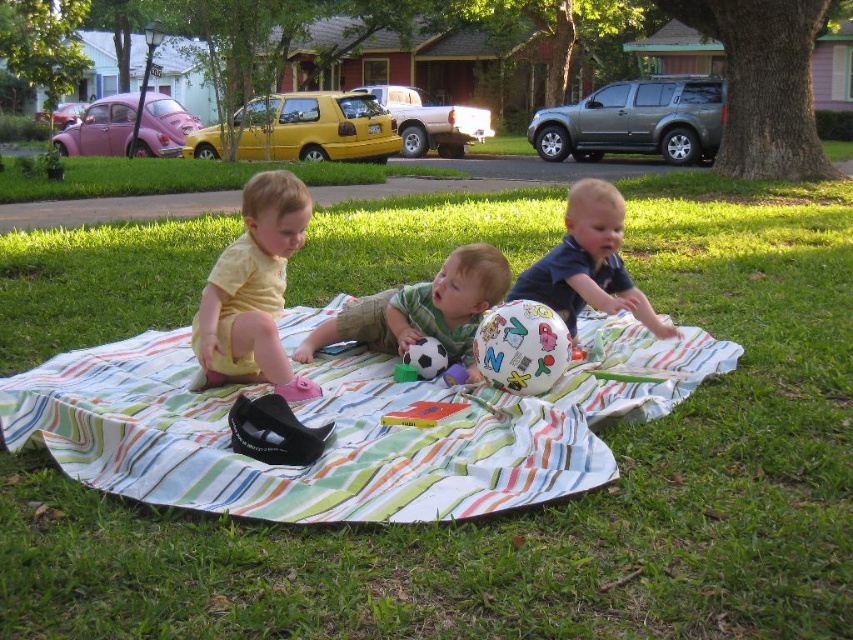
You are a photographer trying to capture a photo of the multicolored rubber ball at center without the yellow matte shirt at left blocking the view. Based on the scene description, can you position yourself in such a way that the ball is visible without the shirt blocking it?

The yellow matte shirt at left is in front of the multicolored rubber ball at center, so to capture the ball without the shirt blocking it, you would need to position yourself behind the ball where the shirt is not obstructing the view.

Consider the image. What is located at the coordinates point (589, 262)?

The blue matte shirt at center is located at point (589, 262).